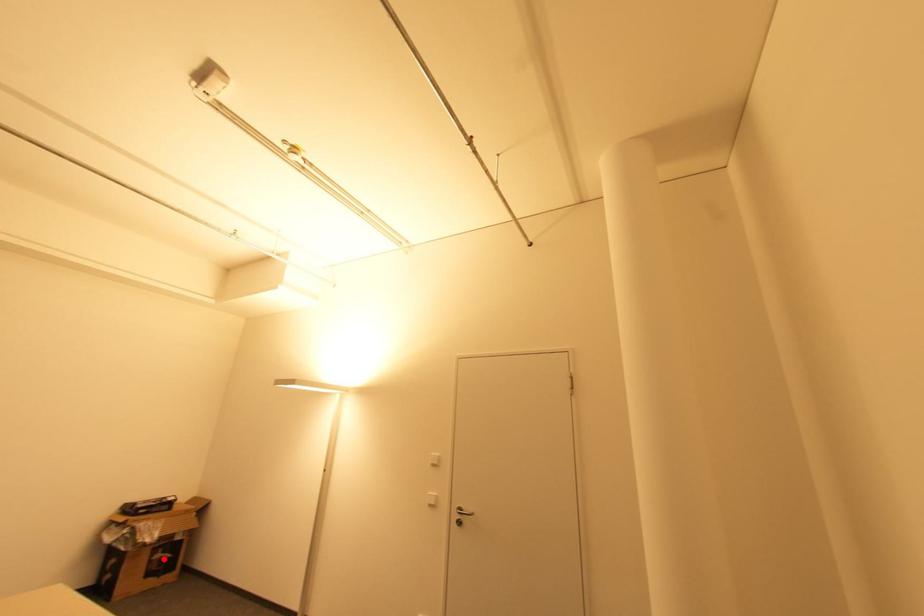
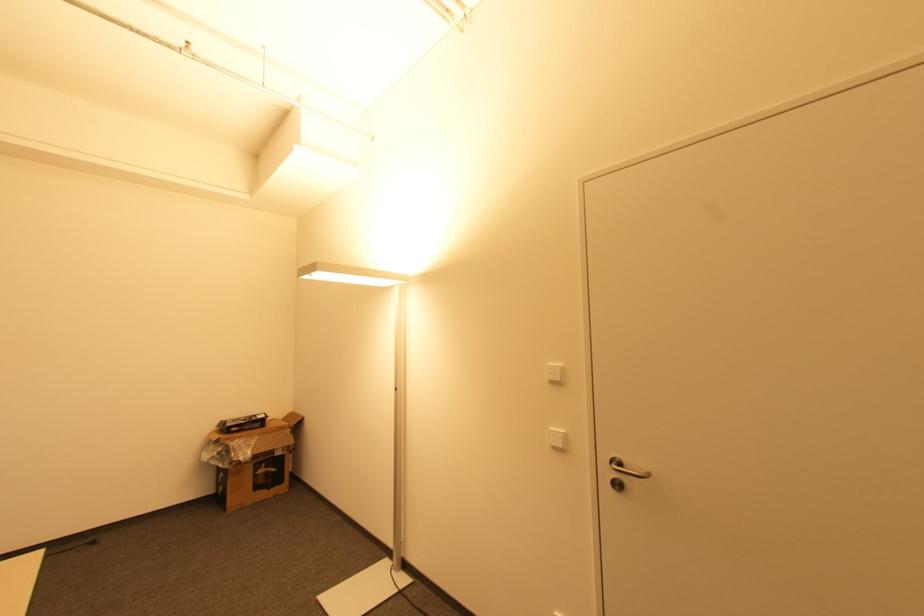
The point at the highlighted location is marked in the first image. Where is the corresponding point in the second image?

(268, 472)